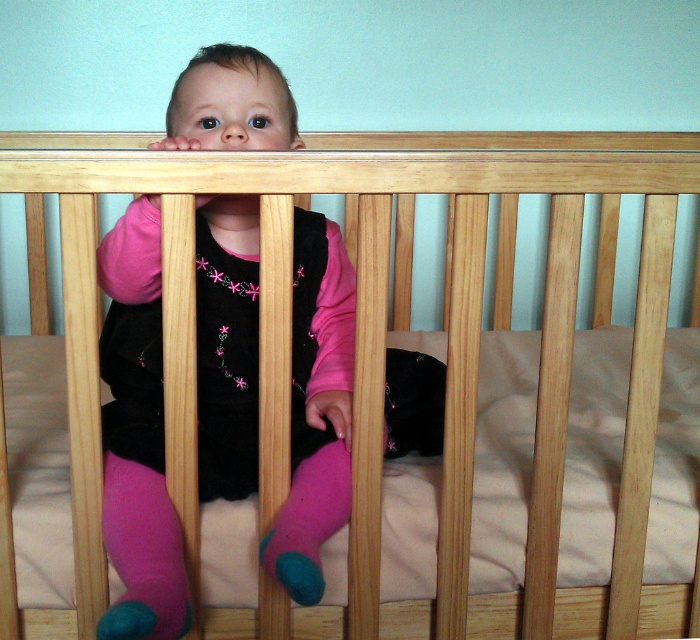
Is pink fabric sock at lower left thinner than pink fuzzy sock at lower center?

No, pink fabric sock at lower left is not thinner than pink fuzzy sock at lower center.

Between pink fabric sock at lower left and pink fuzzy sock at lower center, which one is positioned higher?

pink fuzzy sock at lower center

Does point (154, 515) come farther from viewer compared to point (312, 573)?

Yes.

I want to click on pink fabric sock at lower left, so click(144, 552).

Consider the image. Is matte black dress at center to the right of pink fuzzy sock at lower center from the viewer's perspective?

In fact, matte black dress at center is to the left of pink fuzzy sock at lower center.

Based on the photo, is matte black dress at center taller than pink fuzzy sock at lower center?

Yes.

Is point (133, 496) closer to camera compared to point (286, 541)?

No.

Find the location of a particular element. Image resolution: width=700 pixels, height=640 pixels. matte black dress at center is located at coordinates [x=136, y=436].

Does matte black dress at center have a greater width compared to pink fabric sock at lower left?

Indeed, matte black dress at center has a greater width compared to pink fabric sock at lower left.

Describe the element at coordinates (136, 436) in the screenshot. I see `matte black dress at center` at that location.

Locate an element on the screen. matte black dress at center is located at coordinates (136, 436).